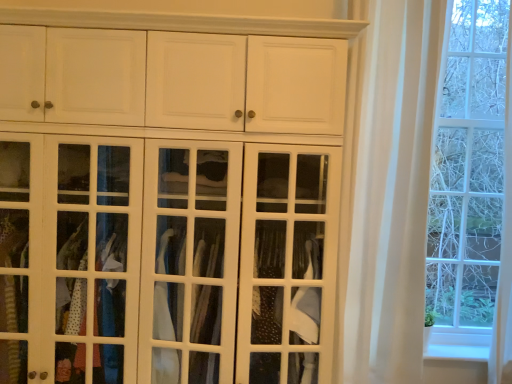
This screenshot has height=384, width=512. What do you see at coordinates (168, 259) in the screenshot? I see `white glass cabinet at center` at bounding box center [168, 259].

At what (x,y) coordinates should I click in order to perform the action: click on white glass cabinet at center. Please return your answer as a coordinate pair (x, y). Looking at the image, I should click on (168, 259).

You are a GUI agent. You are given a task and a screenshot of the screen. Output one action in this format:
    pyautogui.click(x=<x>, y=<y>)
    Task: Click on the white sheer curtain at right
    
    Given the screenshot: What is the action you would take?
    pyautogui.click(x=390, y=187)

This screenshot has width=512, height=384. What do you see at coordinates (390, 187) in the screenshot?
I see `white sheer curtain at right` at bounding box center [390, 187].

Identify the location of white glass cabinet at center. (168, 259).

Between white glass cabinet at center and white sheer curtain at right, which one appears on the right side from the viewer's perspective?

From the viewer's perspective, white sheer curtain at right appears more on the right side.

Considering the positions of objects white glass cabinet at center and white sheer curtain at right in the image provided, who is behind, white glass cabinet at center or white sheer curtain at right?

Positioned behind is white sheer curtain at right.

Is point (152, 349) closer to viewer compared to point (377, 243)?

Yes, it is in front of point (377, 243).

From the image's perspective, which is above, white glass cabinet at center or white sheer curtain at right?

white sheer curtain at right appears higher in the image.

From a real-world perspective, is white glass cabinet at center positioned under white sheer curtain at right based on gravity?

Yes, from a real-world perspective, white glass cabinet at center is below white sheer curtain at right.

Between white glass cabinet at center and white sheer curtain at right, which one has smaller width?

white sheer curtain at right is thinner.

Can you confirm if white glass cabinet at center is taller than white sheer curtain at right?

No.

Which of these two, white glass cabinet at center or white sheer curtain at right, is smaller?

Smaller between the two is white sheer curtain at right.

Would you say white glass cabinet at center is inside or outside white sheer curtain at right?

white glass cabinet at center lies outside white sheer curtain at right.

Is white glass cabinet at center next to white sheer curtain at right and touching it?

No.

Is white glass cabinet at center positioned with its back to white sheer curtain at right?

That's not correct — white glass cabinet at center is not looking away from white sheer curtain at right.

Find the location of a particular element. This screenshot has height=384, width=512. door located on the left of white sheer curtain at right is located at coordinates (168, 259).

Considering the relative positions of white sheer curtain at right and white glass cabinet at center in the image provided, is white sheer curtain at right to the left or to the right of white glass cabinet at center?

Clearly, white sheer curtain at right is on the right of white glass cabinet at center in the image.

Is white sheer curtain at right closer to the viewer compared to white glass cabinet at center?

No, the depth of white sheer curtain at right is greater than that of white glass cabinet at center.

Does point (400, 146) appear closer or farther from the camera than point (261, 231)?

Point (400, 146) is farther from the camera than point (261, 231).

From the image's perspective, is white sheer curtain at right positioned above or below white glass cabinet at center?

Clearly, from the image's perspective, white sheer curtain at right is above white glass cabinet at center.

From a real-world perspective, is white sheer curtain at right physically located above or below white glass cabinet at center?

In terms of real-world spatial position, white sheer curtain at right is above white glass cabinet at center.

From the picture: In terms of width, does white sheer curtain at right look wider or thinner when compared to white glass cabinet at center?

Considering their sizes, white sheer curtain at right looks slimmer than white glass cabinet at center.

Is white sheer curtain at right shorter than white glass cabinet at center?

Incorrect, the height of white sheer curtain at right does not fall short of that of white glass cabinet at center.

Between white sheer curtain at right and white glass cabinet at center, which one has larger size?

white glass cabinet at center.

Would you say white sheer curtain at right is outside white glass cabinet at center?

Absolutely, white sheer curtain at right is external to white glass cabinet at center.

Is white sheer curtain at right touching white glass cabinet at center?

There is a gap between white sheer curtain at right and white glass cabinet at center.

Based on the photo, is white sheer curtain at right looking in the opposite direction of white glass cabinet at center?

white sheer curtain at right does not have its back to white glass cabinet at center.

Looking at this image, what's the angular difference between white sheer curtain at right and white glass cabinet at center's facing directions?

The angle between the facing direction of white sheer curtain at right and the facing direction of white glass cabinet at center is 0.457 degrees.

How distant is white sheer curtain at right from white glass cabinet at center?

They are 71.78 centimeters apart.

Locate an element on the screen. The image size is (512, 384). door below the white sheer curtain at right (from the image's perspective) is located at coordinates (168, 259).

I want to click on curtain lying above the white glass cabinet at center (from the image's perspective), so click(390, 187).

The image size is (512, 384). Find the location of `curtain to the right of white glass cabinet at center`. curtain to the right of white glass cabinet at center is located at coordinates (390, 187).